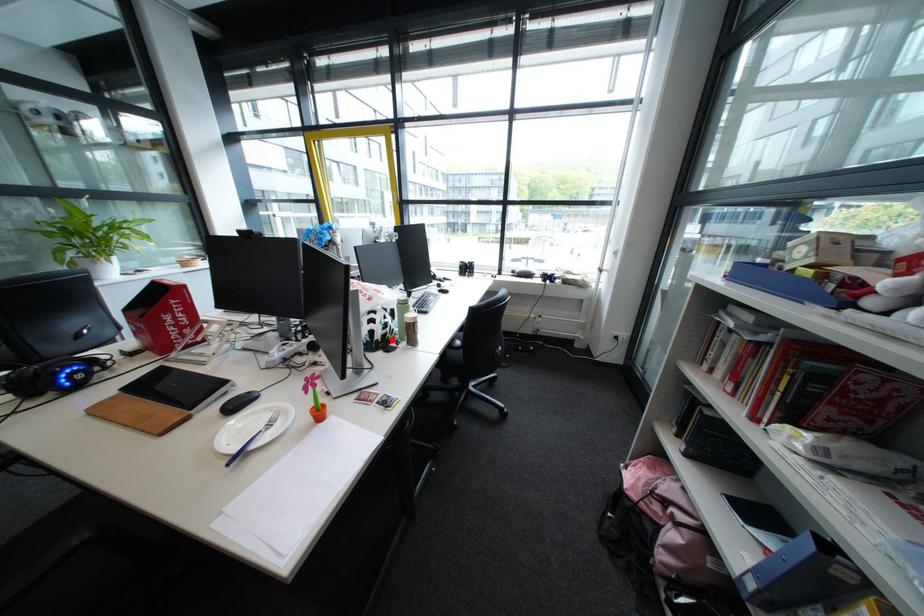
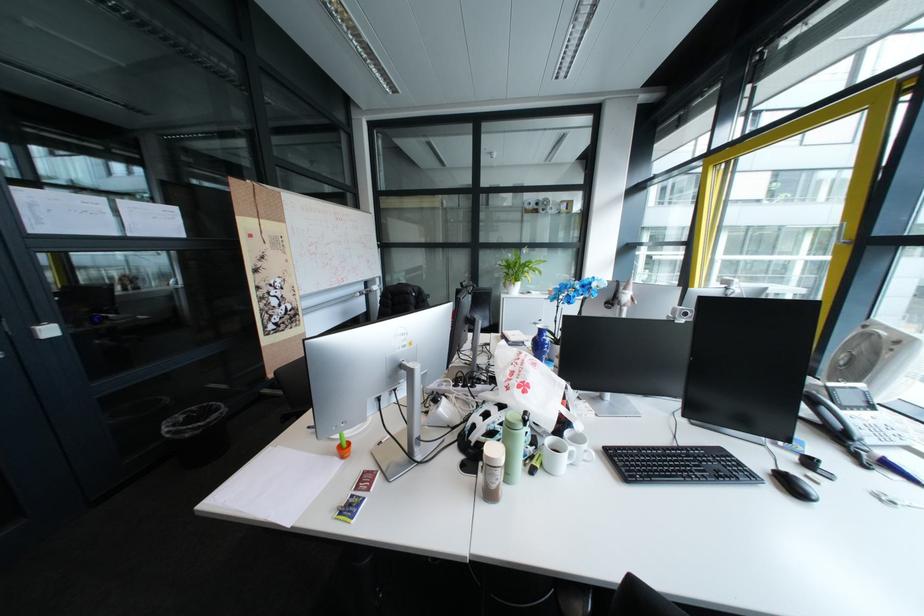
The point at the highlighted location is marked in the first image. Where is the corresponding point in the second image?

(484, 442)